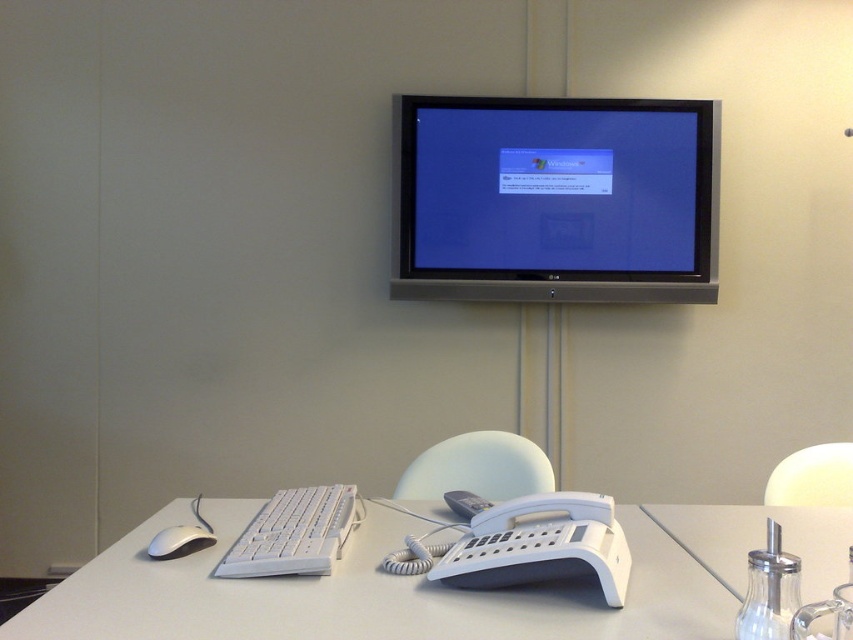
Does black glossy monitor at upper center appear over white matte mouse at lower left?

Yes.

Looking at this image, does black glossy monitor at upper center lie in front of white matte mouse at lower left?

No, black glossy monitor at upper center is further to the viewer.

Between point (697, 289) and point (192, 548), which one is positioned in front?

Point (192, 548) is in front.

At what (x,y) coordinates should I click in order to perform the action: click on black glossy monitor at upper center. Please return your answer as a coordinate pair (x, y). Looking at the image, I should click on (555, 198).

Looking at this image, which is above, clear glass bottle at lower right or white plastic keyboard at lower left?

Positioned higher is white plastic keyboard at lower left.

Is point (718, 570) closer to camera compared to point (331, 531)?

Yes, it is.

Locate an element on the screen. clear glass bottle at lower right is located at coordinates (759, 540).

Is clear glass bottle at lower right below white matte mouse at lower left?

Yes.

Is clear glass bottle at lower right above white matte mouse at lower left?

No, clear glass bottle at lower right is not above white matte mouse at lower left.

Which is in front, point (718, 570) or point (149, 554)?

Point (718, 570) is in front.

Where is `clear glass bottle at lower right`? The height and width of the screenshot is (640, 853). clear glass bottle at lower right is located at coordinates (759, 540).